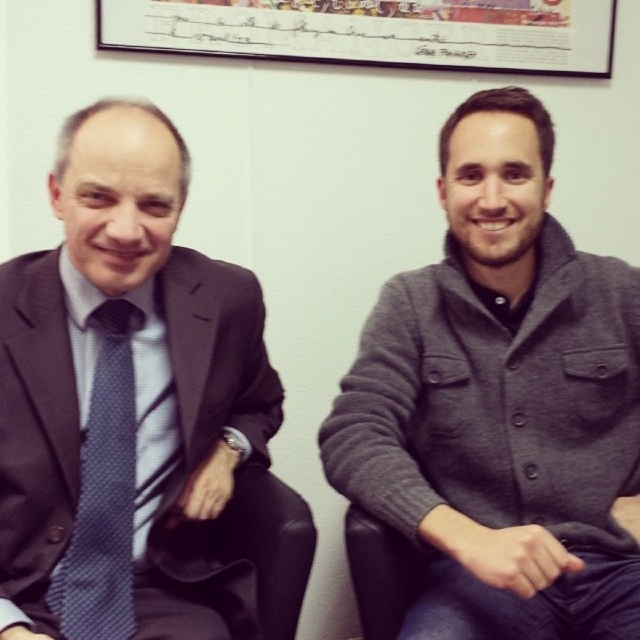
Question: Which point is closer to the camera?

Choices:
 (A) (416, 531)
 (B) (104, 624)
 (C) (204, 22)

Answer: (A)

Question: Can you confirm if gray woolen sweater at right is positioned below framed paper at upper center?

Choices:
 (A) no
 (B) yes

Answer: (B)

Question: From the image, what is the correct spatial relationship of gray woolen sweater at right in relation to matte black suit at left?

Choices:
 (A) right
 (B) left

Answer: (A)

Question: Which object appears farthest from the camera in this image?

Choices:
 (A) gray woolen sweater at right
 (B) framed paper at upper center
 (C) matte blue tie at left

Answer: (B)

Question: Which point appears closest to the camera in this image?

Choices:
 (A) (268, 56)
 (B) (109, 352)
 (C) (161, 200)

Answer: (C)

Question: Observing the image, what is the correct spatial positioning of gray woolen sweater at right in reference to framed paper at upper center?

Choices:
 (A) left
 (B) right

Answer: (B)